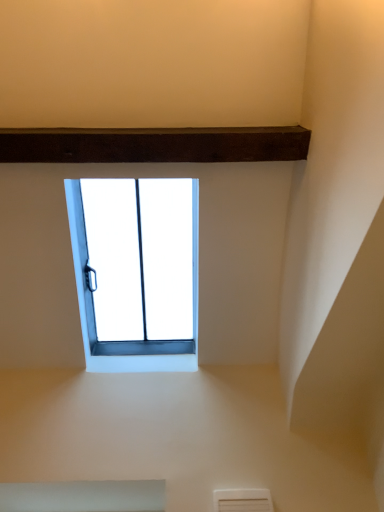
Question: Can you confirm if white plastic window at center is positioned to the right of white plastic air conditioning at lower center?

Choices:
 (A) yes
 (B) no

Answer: (B)

Question: Is white plastic window at center taller than white plastic air conditioning at lower center?

Choices:
 (A) no
 (B) yes

Answer: (B)

Question: Is white plastic window at center completely or partially outside of white plastic air conditioning at lower center?

Choices:
 (A) no
 (B) yes

Answer: (B)

Question: From the image's perspective, is white plastic window at center over white plastic air conditioning at lower center?

Choices:
 (A) no
 (B) yes

Answer: (B)

Question: From a real-world perspective, does white plastic window at center stand above white plastic air conditioning at lower center?

Choices:
 (A) yes
 (B) no

Answer: (A)

Question: Does white plastic window at center contain white plastic air conditioning at lower center?

Choices:
 (A) no
 (B) yes

Answer: (A)

Question: Is the position of white plastic air conditioning at lower center less distant than that of white plastic window at center?

Choices:
 (A) no
 (B) yes

Answer: (A)

Question: Does white plastic air conditioning at lower center have a greater height compared to white plastic window at center?

Choices:
 (A) yes
 (B) no

Answer: (B)

Question: Is white plastic air conditioning at lower center thinner than white plastic window at center?

Choices:
 (A) no
 (B) yes

Answer: (B)

Question: Is white plastic air conditioning at lower center placed right next to white plastic window at center?

Choices:
 (A) no
 (B) yes

Answer: (A)

Question: Is white plastic air conditioning at lower center at the right side of white plastic window at center?

Choices:
 (A) yes
 (B) no

Answer: (A)

Question: Does white plastic air conditioning at lower center have a larger size compared to white plastic window at center?

Choices:
 (A) no
 (B) yes

Answer: (A)

Question: Looking at the image, does white plastic air conditioning at lower center seem bigger or smaller compared to white plastic window at center?

Choices:
 (A) big
 (B) small

Answer: (B)